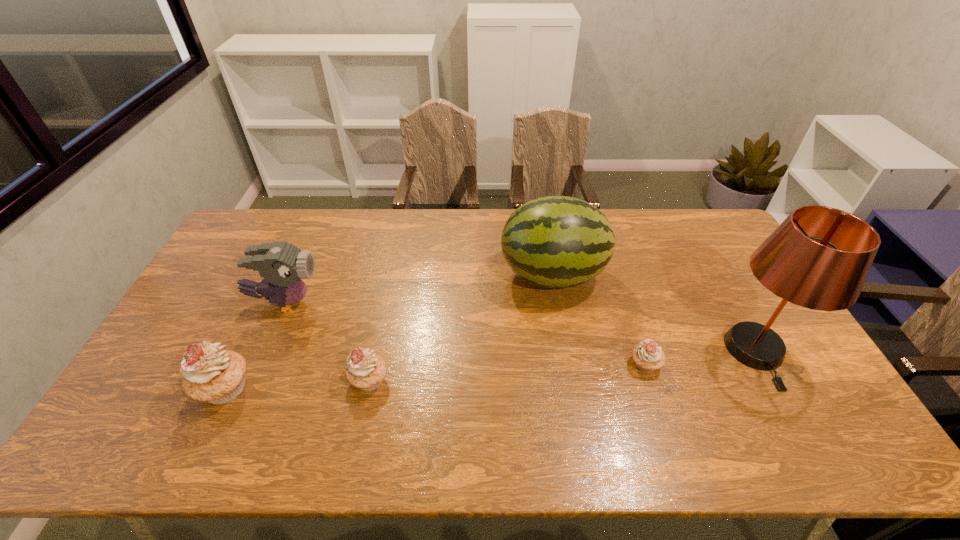
The image size is (960, 540). Identify the location of free spot between the fifth tallest object and the bird. (327, 341).

Find the location of a particular element. The width and height of the screenshot is (960, 540). vacant area between the watermelon and the rightmost cupcake is located at coordinates (599, 320).

Locate an element on the screen. vacant region between the watermelon and the third tallest object is located at coordinates point(419,289).

Find the location of a particular element. free space that is in between the tallest cupcake and the fifth tallest object is located at coordinates (297, 384).

Identify the location of vacant point located between the leftmost cupcake and the rightmost object. Image resolution: width=960 pixels, height=540 pixels. (490, 370).

Where is `empty location between the leftmost cupcake and the shortest object`? empty location between the leftmost cupcake and the shortest object is located at coordinates (435, 376).

Find the location of a particular element. The height and width of the screenshot is (540, 960). free area in between the rightmost cupcake and the fifth shortest object is located at coordinates (599, 320).

Find the location of a particular element. free space that is in between the watermelon and the bird is located at coordinates (419, 289).

Locate an element on the screen. free area in between the bird and the rightmost object is located at coordinates (520, 327).

I want to click on vacant region between the rightmost object and the third tallest object, so click(520, 327).